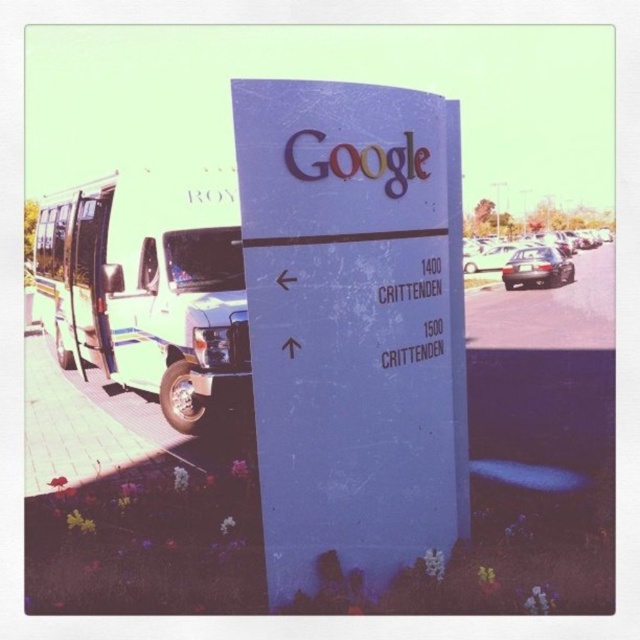
Looking at this image, between shiny black sedan at right and shiny silver sedan at center, which one has less height?

shiny silver sedan at center is shorter.

Consider the image. Is shiny black sedan at right to the left of shiny silver sedan at center from the viewer's perspective?

No, shiny black sedan at right is not to the left of shiny silver sedan at center.

Does point (504, 262) lie in front of point (502, 260)?

Yes, point (504, 262) is in front of point (502, 260).

The width and height of the screenshot is (640, 640). What are the coordinates of `shiny black sedan at right` in the screenshot? It's located at (496, 259).

Between metallic silver sedan at right and shiny black sedan at right, which one is positioned higher?

shiny black sedan at right

Can you confirm if metallic silver sedan at right is positioned to the left of shiny black sedan at right?

Yes, metallic silver sedan at right is to the left of shiny black sedan at right.

Is point (516, 278) less distant than point (515, 243)?

That is True.

Image resolution: width=640 pixels, height=640 pixels. Find the location of `metallic silver sedan at right`. metallic silver sedan at right is located at coordinates (538, 268).

Is point (86, 186) farther from camera compared to point (470, 260)?

No, (86, 186) is closer to viewer.

Is white metallic van at left in front of shiny black sedan at right?

No, white metallic van at left is further to the viewer.

The height and width of the screenshot is (640, 640). Describe the element at coordinates (147, 288) in the screenshot. I see `white metallic van at left` at that location.

This screenshot has height=640, width=640. I want to click on white metallic van at left, so pyautogui.click(x=147, y=288).